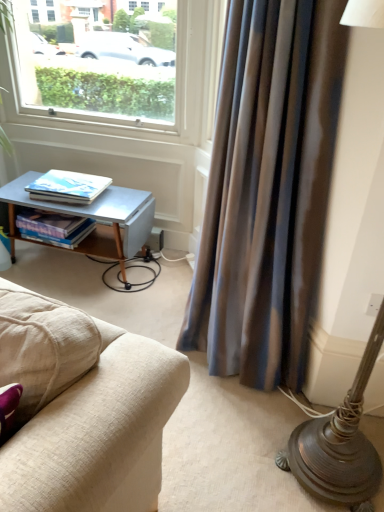
Question: Could you tell me if silky blue curtain at right is turned towards metallic gray table at lower left?

Choices:
 (A) yes
 (B) no

Answer: (B)

Question: Is silky blue curtain at right next to metallic gray table at lower left and touching it?

Choices:
 (A) yes
 (B) no

Answer: (B)

Question: Is silky blue curtain at right looking in the opposite direction of metallic gray table at lower left?

Choices:
 (A) yes
 (B) no

Answer: (B)

Question: Can we say silky blue curtain at right lies outside metallic gray table at lower left?

Choices:
 (A) no
 (B) yes

Answer: (B)

Question: From the image's perspective, is silky blue curtain at right located beneath metallic gray table at lower left?

Choices:
 (A) yes
 (B) no

Answer: (B)

Question: Considering the relative sizes of silky blue curtain at right and metallic gray table at lower left in the image provided, is silky blue curtain at right smaller than metallic gray table at lower left?

Choices:
 (A) yes
 (B) no

Answer: (B)

Question: Can you confirm if hardcover books at lower left, which appears as the 1th book when ordered from the bottom, is positioned to the right of white plastic window at upper left?

Choices:
 (A) no
 (B) yes

Answer: (A)

Question: Is hardcover books at lower left, which is counted as the second book, starting from the top, wider than white plastic window at upper left?

Choices:
 (A) no
 (B) yes

Answer: (B)

Question: Is hardcover books at lower left, which is counted as the second book, starting from the top, positioned behind white plastic window at upper left?

Choices:
 (A) no
 (B) yes

Answer: (B)

Question: Considering the relative sizes of hardcover books at lower left, which appears as the 1th book when ordered from the bottom, and white plastic window at upper left in the image provided, is hardcover books at lower left, which appears as the 1th book when ordered from the bottom, smaller than white plastic window at upper left?

Choices:
 (A) yes
 (B) no

Answer: (A)

Question: Is hardcover books at lower left, which is counted as the second book, starting from the top, bigger than white plastic window at upper left?

Choices:
 (A) no
 (B) yes

Answer: (A)

Question: Can you confirm if hardcover books at lower left, which is counted as the second book, starting from the top, is taller than white plastic window at upper left?

Choices:
 (A) yes
 (B) no

Answer: (B)

Question: Considering the relative sizes of white plastic window at upper left and matte white book at left, which is counted as the second book, starting from the bottom, in the image provided, is white plastic window at upper left thinner than matte white book at left, which is counted as the second book, starting from the bottom,?

Choices:
 (A) yes
 (B) no

Answer: (A)